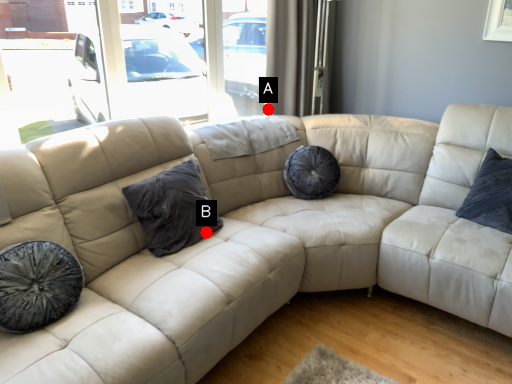
Question: Two points are circled on the image, labeled by A and B beside each circle. Which point is farther from the camera taking this photo?

Choices:
 (A) A is further
 (B) B is further

Answer: (A)